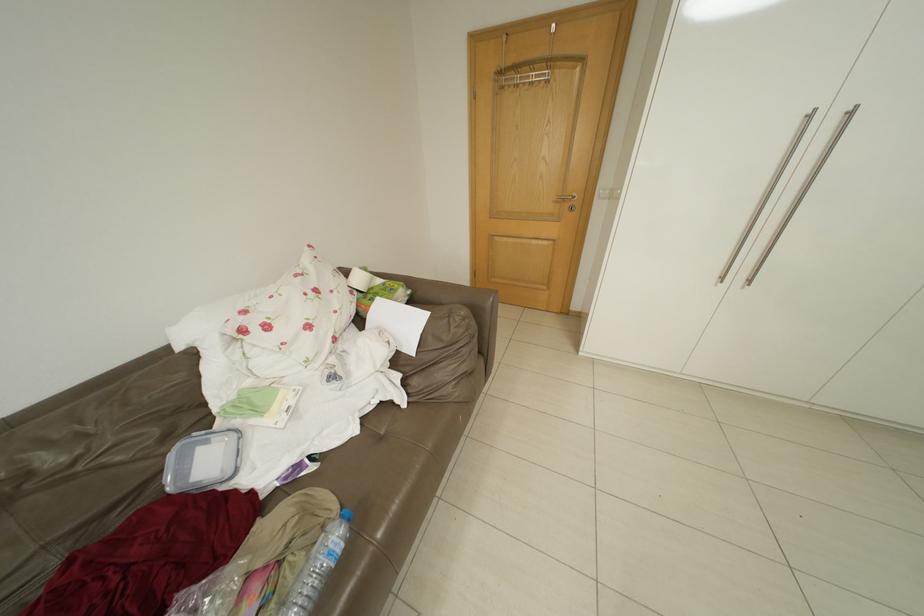
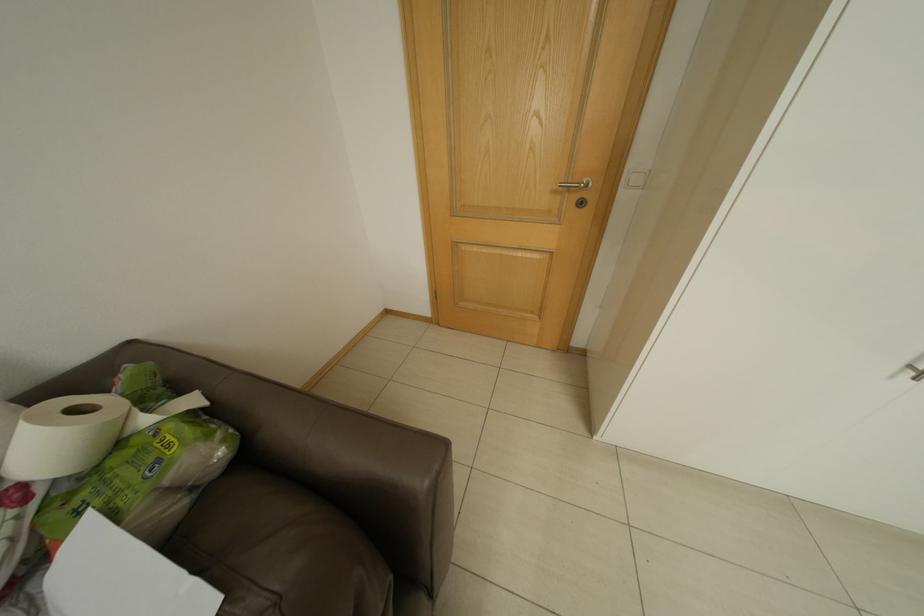
Question: The camera is either moving clockwise (left) or counter-clockwise (right) around the object. The first image is from the beginning of the video and the second image is from the end. Is the camera moving left or right when shooting the video?

Choices:
 (A) Left
 (B) Right

Answer: (A)